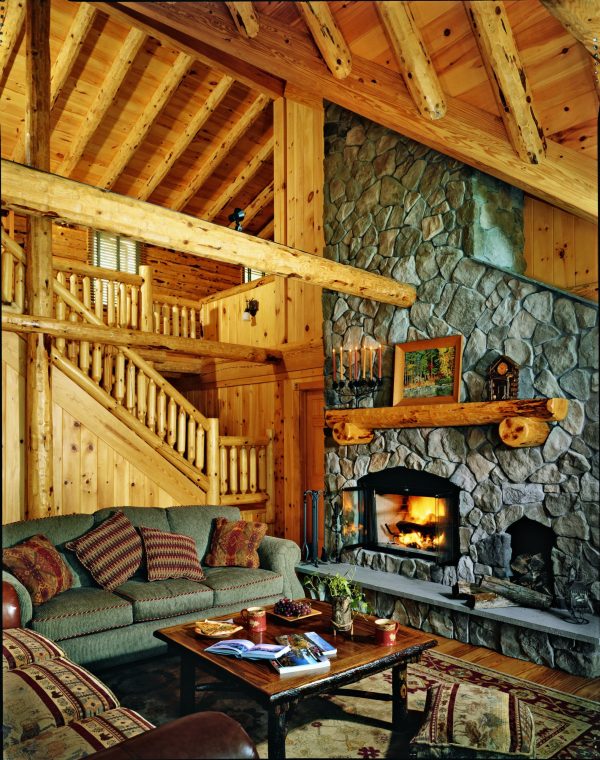
You are a GUI agent. You are given a task and a screenshot of the screen. Output one action in this format:
    pyautogui.click(x=<x>, y=<y>)
    Task: Click on the dark red coffee mug
    The image size is (600, 760).
    Given the screenshot: What is the action you would take?
    pyautogui.click(x=256, y=622)